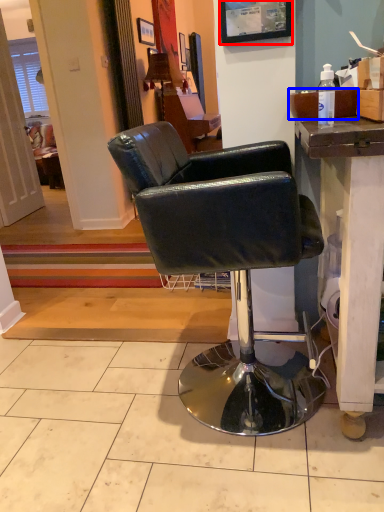
Question: Which object appears closest to the camera in this image, picture frame (highlighted by a red box) or box (highlighted by a blue box)?

Choices:
 (A) picture frame
 (B) box

Answer: (B)